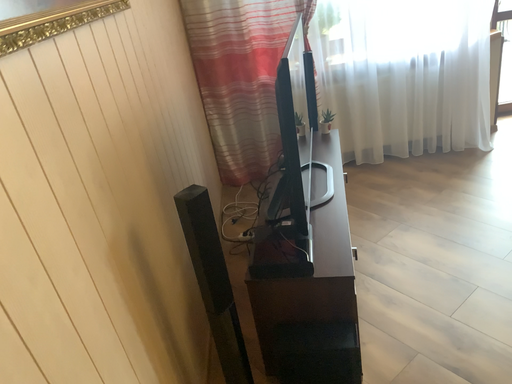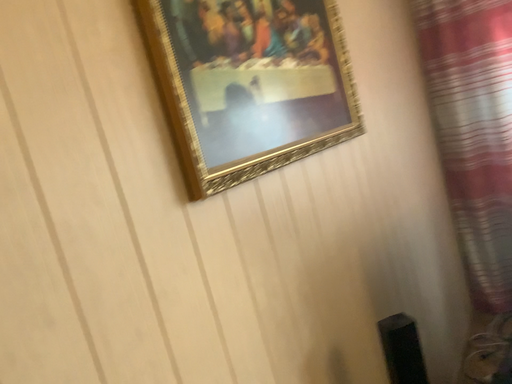
Question: How did the camera likely rotate when shooting the video?

Choices:
 (A) rotated right
 (B) rotated left

Answer: (B)